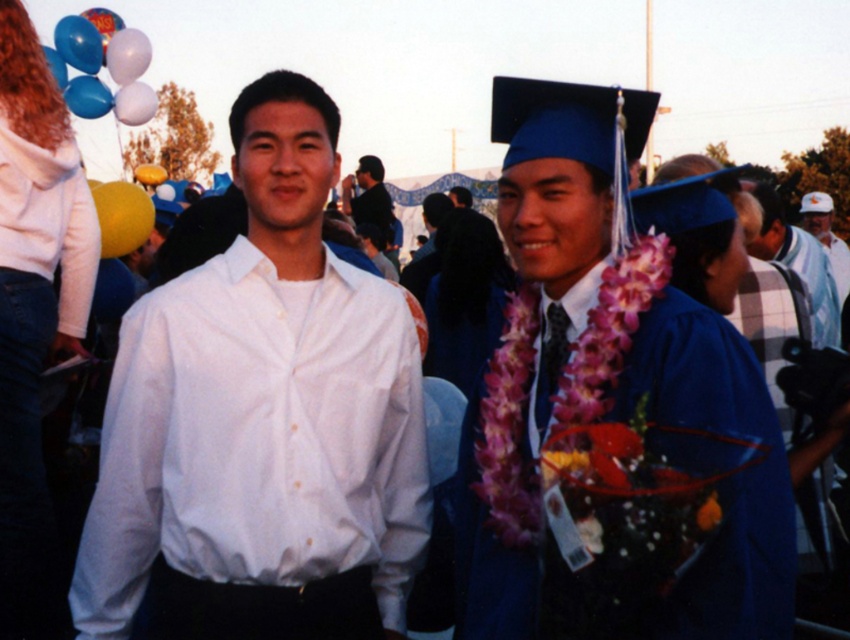
You are a photographer at the graduation event. You want to take a photo of the blue matte graduation gown at center. Where should you focus your camera to capture it perfectly?

You should focus your camera at point [740,477] to capture the blue matte graduation gown at center perfectly.

Looking at this image, you are a photographer at the graduation event and want to capture a photo that shows both the white matte robe at left and the dark blue fabric jacket at center clearly. Considering their heights, which one might you need to adjust your camera angle to focus on?

The white matte robe at left is much taller than the dark blue fabric jacket at center, so you might need to lower your camera angle to focus on the dark blue fabric jacket at center while still capturing the white matte robe at left.